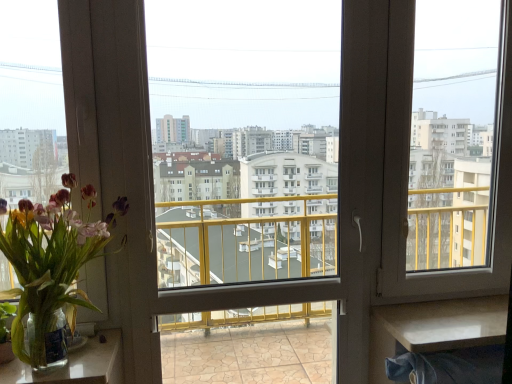
The width and height of the screenshot is (512, 384). In order to click on free location in front of transparent glass window screen at right, marked as the 1th window screen in a right-to-left arrangement in this screenshot , I will do (x=463, y=319).